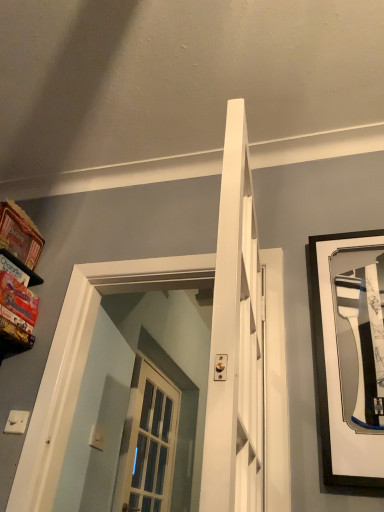
Question: Does black matte picture frame at right have a lesser height compared to matte cardboard shelf at left?

Choices:
 (A) no
 (B) yes

Answer: (A)

Question: Does black matte picture frame at right appear on the right side of matte cardboard shelf at left?

Choices:
 (A) no
 (B) yes

Answer: (B)

Question: Is black matte picture frame at right thinner than matte cardboard shelf at left?

Choices:
 (A) no
 (B) yes

Answer: (B)

Question: Is black matte picture frame at right looking in the opposite direction of matte cardboard shelf at left?

Choices:
 (A) no
 (B) yes

Answer: (A)

Question: Is black matte picture frame at right with matte cardboard shelf at left?

Choices:
 (A) no
 (B) yes

Answer: (A)

Question: Is the depth of black matte picture frame at right greater than that of matte cardboard shelf at left?

Choices:
 (A) no
 (B) yes

Answer: (A)

Question: Can you confirm if black matte picture frame at right is positioned to the left of white plastic light switch at lower left?

Choices:
 (A) no
 (B) yes

Answer: (A)

Question: Would you say black matte picture frame at right is a long distance from white plastic light switch at lower left?

Choices:
 (A) yes
 (B) no

Answer: (A)

Question: Does black matte picture frame at right have a greater height compared to white plastic light switch at lower left?

Choices:
 (A) yes
 (B) no

Answer: (A)

Question: Can you confirm if black matte picture frame at right is smaller than white plastic light switch at lower left?

Choices:
 (A) no
 (B) yes

Answer: (A)

Question: Would you say black matte picture frame at right contains white plastic light switch at lower left?

Choices:
 (A) no
 (B) yes

Answer: (A)

Question: Is black matte picture frame at right shorter than white plastic light switch at lower left?

Choices:
 (A) yes
 (B) no

Answer: (B)

Question: Can you confirm if white plastic light switch at lower left is bigger than matte cardboard shelf at left?

Choices:
 (A) yes
 (B) no

Answer: (B)